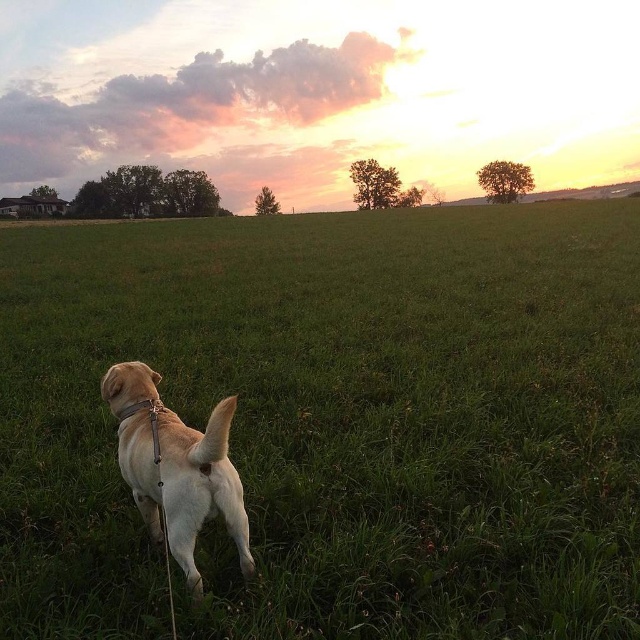
You are standing in the middle of the green grassy field at center and want to walk towards the golden fur dog at center. Which direction should you head?

The golden fur dog at center is located at the lower left portion of the frame, so you should head towards the lower left direction to reach it.

You are standing in the middle of the green grassy field at center and want to find the golden fur dog at center. Which direction should you walk to locate it?

The golden fur dog at center is on the left side of the green grassy field at center, so you should walk to the left to locate it.